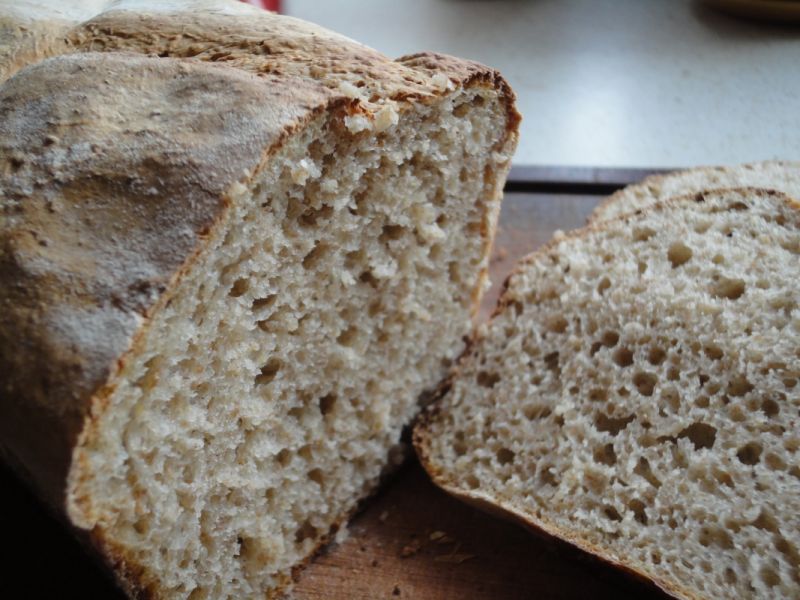
This screenshot has height=600, width=800. Find the location of `wooden cutting board`. wooden cutting board is located at coordinates (394, 551), (530, 226).